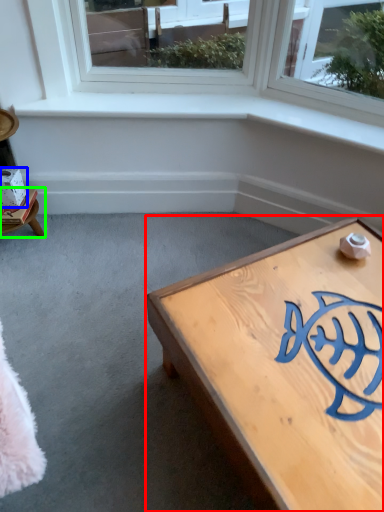
Question: Considering the real-world distances, which object is farthest from coffee table (highlighted by a red box)? box (highlighted by a blue box) or furniture (highlighted by a green box)?

Choices:
 (A) box
 (B) furniture

Answer: (A)